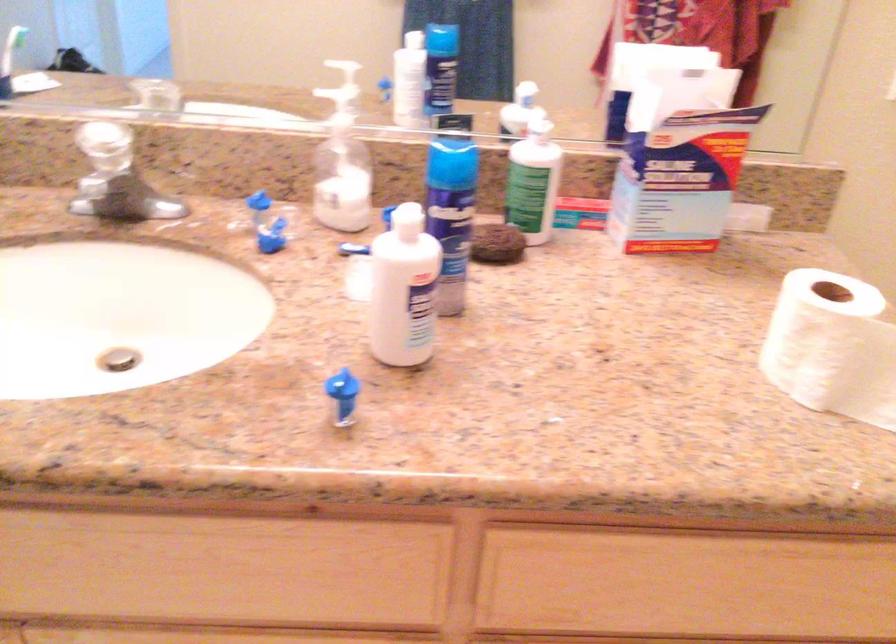
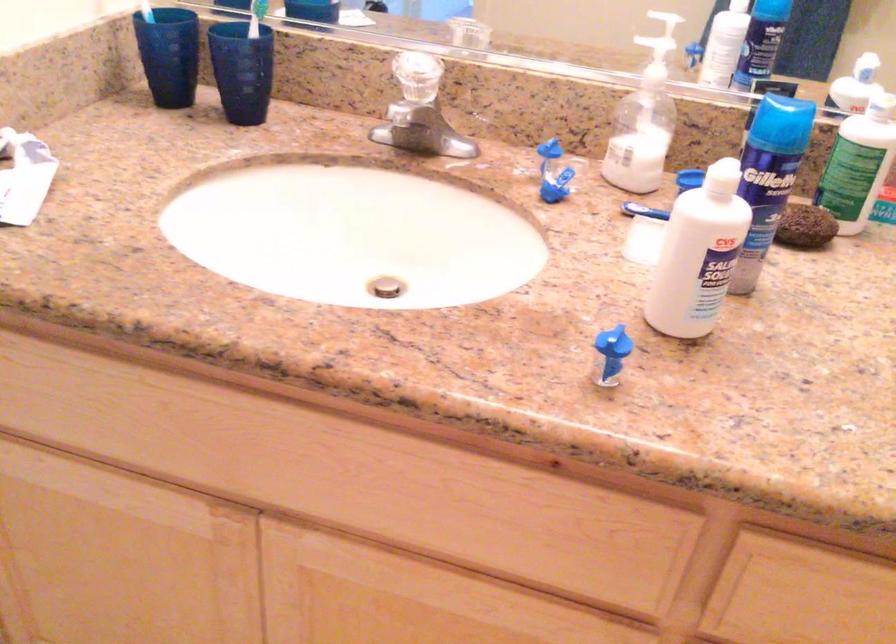
The point at [401,289] is marked in the first image. Where is the corresponding point in the second image?

(698, 254)